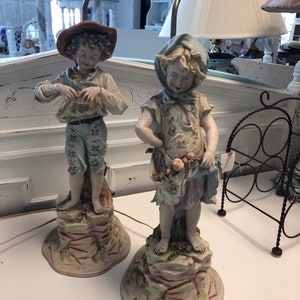
Locate an element on the screen. This screenshot has width=300, height=300. stands is located at coordinates pyautogui.click(x=76, y=237), pyautogui.click(x=176, y=278).